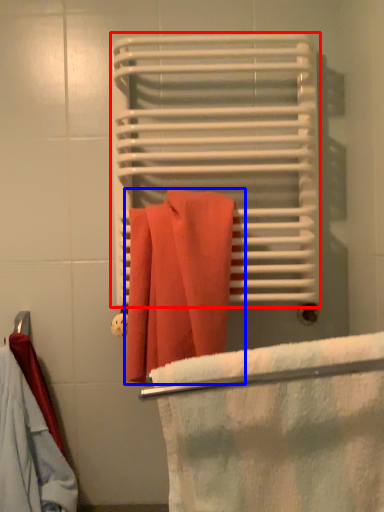
Question: Which object is closer to the camera taking this photo, bath towel (highlighted by a red box) or towel (highlighted by a blue box)?

Choices:
 (A) bath towel
 (B) towel

Answer: (B)